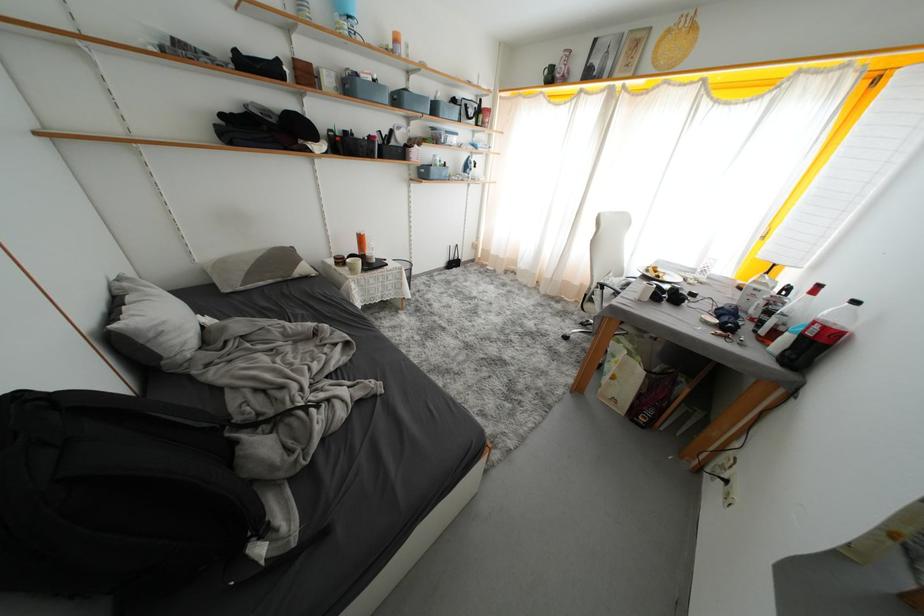
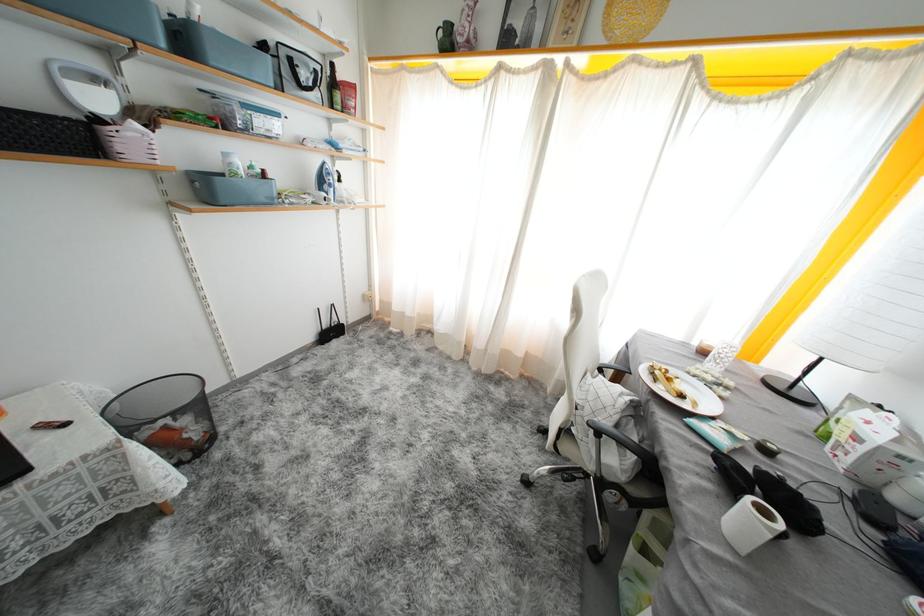
The point at (406, 132) is marked in the first image. Where is the corresponding point in the second image?

(103, 84)